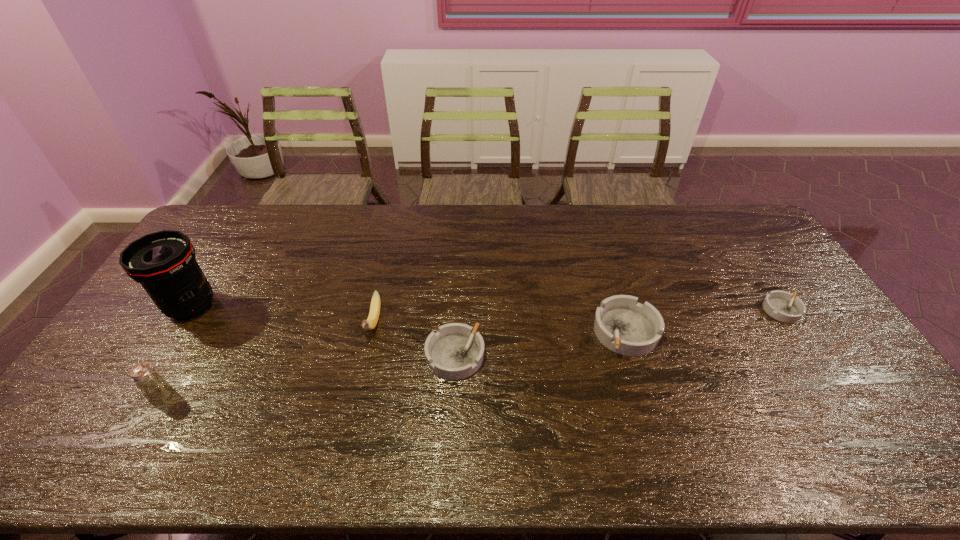
The image size is (960, 540). In the image, there is a desktop. What are the coordinates of `vacant space at the near edge` in the screenshot? It's located at (376, 415).

The image size is (960, 540). In order to click on vacant space at the left edge of the desktop in this screenshot , I will do `click(126, 377)`.

This screenshot has width=960, height=540. Find the location of `free location at the right edge`. free location at the right edge is located at coordinates [756, 260].

In the image, there is a desktop. Where is `free space at the far left corner`? free space at the far left corner is located at coordinates (242, 211).

The height and width of the screenshot is (540, 960). I want to click on free space between the saltshaker and the fifth object from left to right, so click(394, 363).

Find the location of a particular element. This screenshot has height=540, width=960. free space between the third object from left to right and the tallest object is located at coordinates (282, 314).

The image size is (960, 540). In order to click on vacant point located between the second ashtray from left to right and the saltshaker in this screenshot , I will do `click(394, 363)`.

Find the location of a particular element. Image resolution: width=960 pixels, height=540 pixels. vacant point located between the tallest object and the rightmost ashtray is located at coordinates (487, 308).

Where is `free space between the banana and the rightmost ashtray`? Image resolution: width=960 pixels, height=540 pixels. free space between the banana and the rightmost ashtray is located at coordinates (578, 316).

The width and height of the screenshot is (960, 540). I want to click on empty location between the second ashtray from left to right and the leftmost ashtray, so click(540, 344).